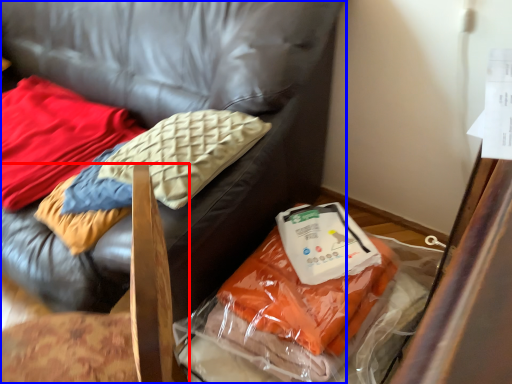
Question: Among these objects, which one is farthest to the camera, furniture (highlighted by a red box) or furniture (highlighted by a blue box)?

Choices:
 (A) furniture
 (B) furniture

Answer: (B)